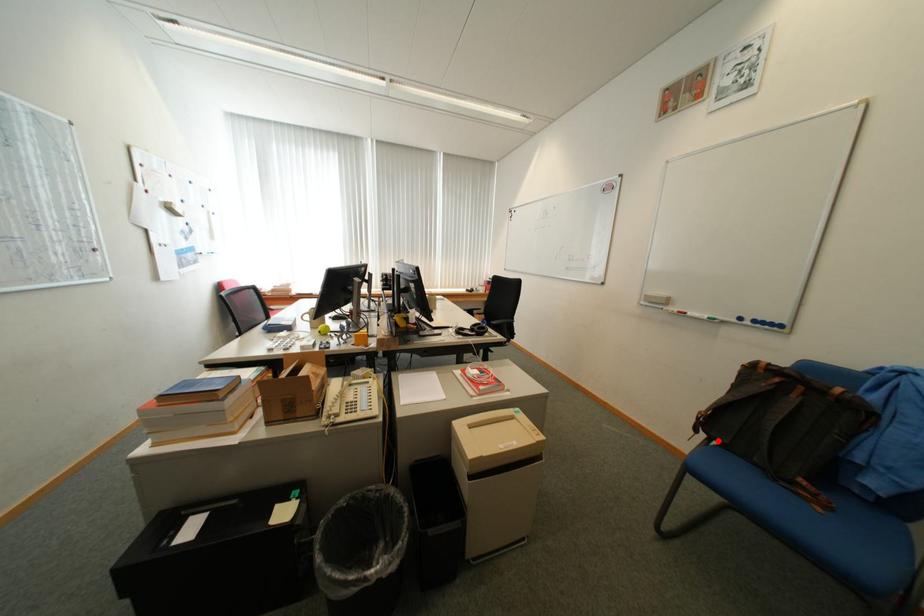
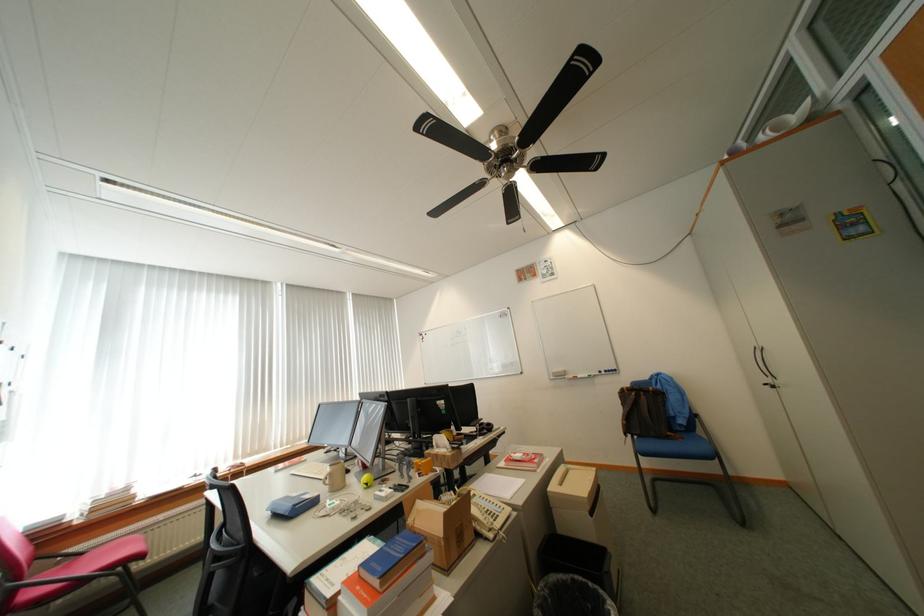
Find the pixel in the second image that matches the highlighted location in the first image.

(641, 438)